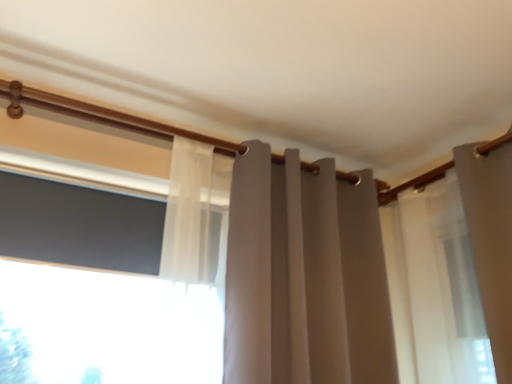
What is the approximate height of matte gray curtain at center?

The height of matte gray curtain at center is 35.11 inches.

This screenshot has width=512, height=384. What do you see at coordinates (364, 269) in the screenshot?
I see `matte gray curtain at center` at bounding box center [364, 269].

Find the location of `matte gray curtain at center`. matte gray curtain at center is located at coordinates (364, 269).

Measure the distance between black matte window screen at left and camera.

A distance of 1.35 meters exists between black matte window screen at left and camera.

What is the approximate height of black matte window screen at left?

The height of black matte window screen at left is 32.60 centimeters.

The width and height of the screenshot is (512, 384). Find the location of `black matte window screen at left`. black matte window screen at left is located at coordinates (79, 225).

The width and height of the screenshot is (512, 384). What do you see at coordinates (79, 225) in the screenshot? I see `black matte window screen at left` at bounding box center [79, 225].

I want to click on matte gray curtain at center, so click(364, 269).

Which object is positioned more to the left, matte gray curtain at center or black matte window screen at left?

Positioned to the left is black matte window screen at left.

Considering the relative positions of matte gray curtain at center and black matte window screen at left in the image provided, is matte gray curtain at center in front of black matte window screen at left?

Yes, it is in front of black matte window screen at left.

Considering the positions of point (255, 195) and point (126, 267), is point (255, 195) closer or farther from the camera than point (126, 267)?

Point (255, 195) is farther from the camera than point (126, 267).

From the image's perspective, would you say matte gray curtain at center is shown under black matte window screen at left?

Yes, from the image's perspective, matte gray curtain at center is beneath black matte window screen at left.

From a real-world perspective, which is physically below, matte gray curtain at center or black matte window screen at left?

matte gray curtain at center, from a real-world perspective.

Consider the image. Considering the sizes of objects matte gray curtain at center and black matte window screen at left in the image provided, who is thinner, matte gray curtain at center or black matte window screen at left?

With smaller width is black matte window screen at left.

Which of these two, matte gray curtain at center or black matte window screen at left, stands taller?

A: matte gray curtain at center is taller.

Does matte gray curtain at center have a larger size compared to black matte window screen at left?

Yes, matte gray curtain at center is bigger than black matte window screen at left.

Is matte gray curtain at center situated inside black matte window screen at left or outside?

matte gray curtain at center exists outside the volume of black matte window screen at left.

Would you consider matte gray curtain at center to be distant from black matte window screen at left?

No, matte gray curtain at center is not far away from black matte window screen at left.

Is matte gray curtain at center facing towards black matte window screen at left?

No.

Can you tell me how much matte gray curtain at center and black matte window screen at left differ in facing direction?

The angle between the facing direction of matte gray curtain at center and the facing direction of black matte window screen at left is 2.7 degrees.

You are a GUI agent. You are given a task and a screenshot of the screen. Output one action in this format:
    pyautogui.click(x=<x>, y=<y>)
    Task: Click on the curtain in front of the black matte window screen at left
    This screenshot has width=512, height=384.
    Given the screenshot: What is the action you would take?
    pyautogui.click(x=364, y=269)

Would you say black matte window screen at left is to the left or to the right of matte gray curtain at center in the picture?

Clearly, black matte window screen at left is on the left of matte gray curtain at center in the image.

Is the depth of black matte window screen at left greater than that of matte gray curtain at center?

Yes, black matte window screen at left is further from the camera.

Does point (123, 260) lie behind point (468, 155)?

No, it is in front of (468, 155).

From the image's perspective, is black matte window screen at left located above or below matte gray curtain at center?

Based on their image positions, black matte window screen at left is located above matte gray curtain at center.

From a real-world perspective, does black matte window screen at left stand above matte gray curtain at center?

Yes, from a real-world perspective, black matte window screen at left is above matte gray curtain at center.

Is black matte window screen at left wider than matte gray curtain at center?

No.

Does black matte window screen at left have a lesser height compared to matte gray curtain at center?

Correct, black matte window screen at left is not as tall as matte gray curtain at center.

Which of these two, black matte window screen at left or matte gray curtain at center, is bigger?

Bigger between the two is matte gray curtain at center.

Based on the photo, is matte gray curtain at center completely or partially inside black matte window screen at left?

Definitely not — matte gray curtain at center is not inside black matte window screen at left.

Are black matte window screen at left and matte gray curtain at center beside each other?

They are not placed beside each other.

Is black matte window screen at left facing towards matte gray curtain at center?

No, black matte window screen at left is not aimed at matte gray curtain at center.

How many degrees apart are the facing directions of black matte window screen at left and matte gray curtain at center?

The facing directions of black matte window screen at left and matte gray curtain at center are 2.7 degrees apart.

The height and width of the screenshot is (384, 512). In order to click on window screen to the left of matte gray curtain at center in this screenshot , I will do `click(79, 225)`.

Where is `window screen lying behind the matte gray curtain at center`? window screen lying behind the matte gray curtain at center is located at coordinates (79, 225).

Identify the location of curtain on the right of black matte window screen at left. (364, 269).